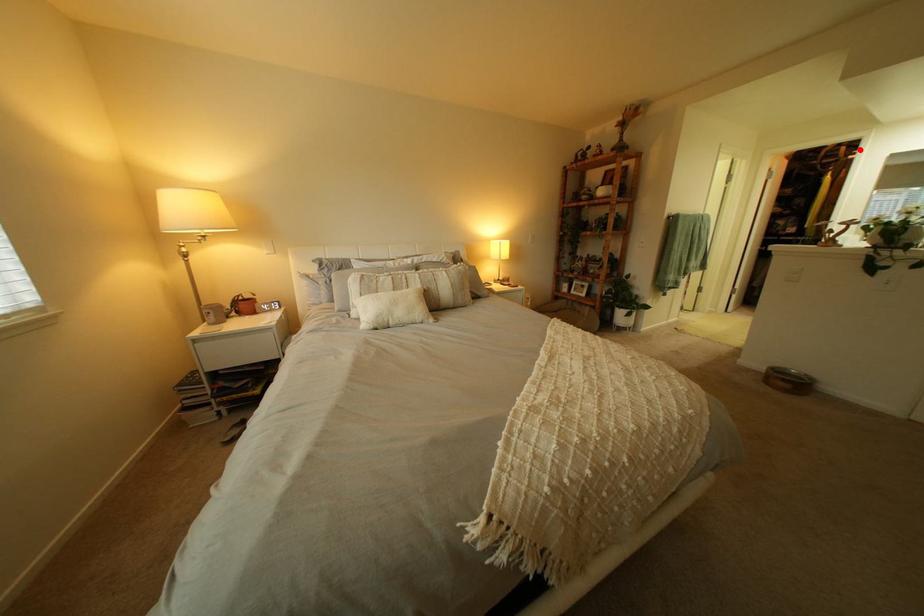
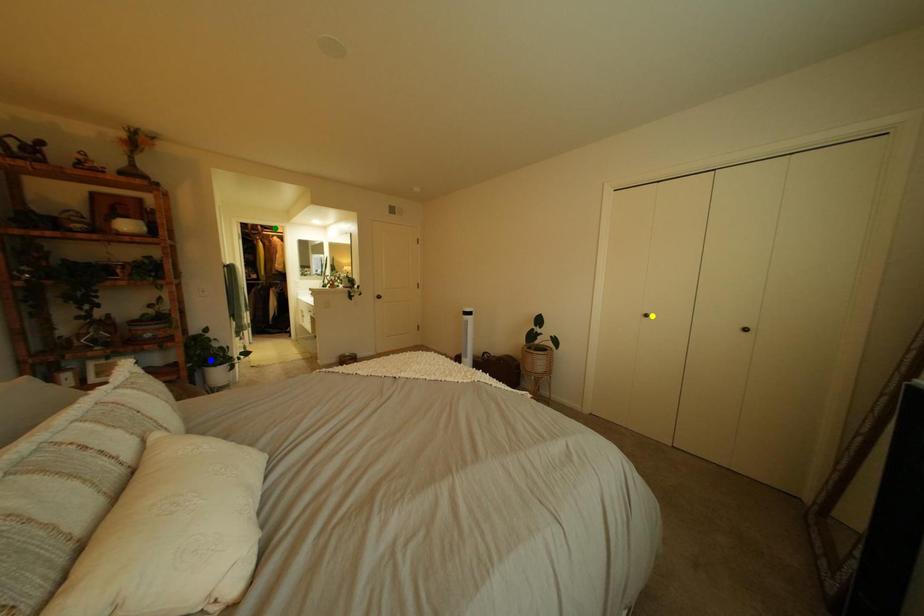
Question: I am providing you with two images of the same scene from different viewpoints. A red point is marked on the first image. You are given multiple points on the second image. Can you choose the point in image 2 that corresponds to the point in image 1?

Choices:
 (A) yellow point
 (B) green point
 (C) blue point

Answer: (B)